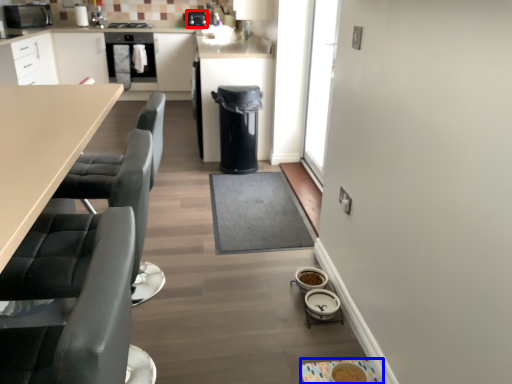
Question: Which object is closer to the camera taking this photo, appliance (highlighted by a red box) or appliance (highlighted by a blue box)?

Choices:
 (A) appliance
 (B) appliance

Answer: (B)